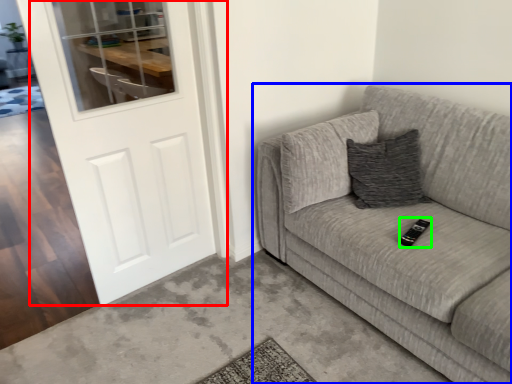
Question: Estimate the real-world distances between objects in this image. Which object is closer to door (highlighted by a red box), studio couch (highlighted by a blue box) or remote (highlighted by a green box)?

Choices:
 (A) studio couch
 (B) remote

Answer: (A)